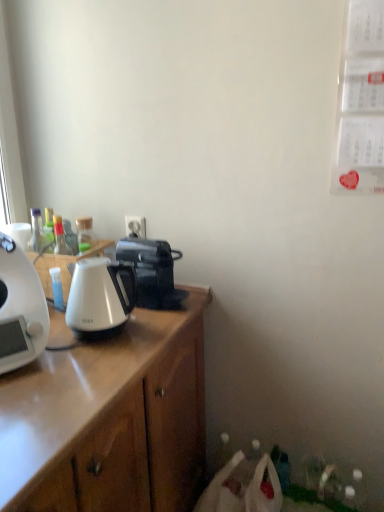
Question: Does white glossy coffee maker at left, which is counted as the 2th coffee maker, starting from the back, have a larger size compared to white glossy kettle at left?

Choices:
 (A) yes
 (B) no

Answer: (A)

Question: Can you confirm if white glossy coffee maker at left, which is counted as the 2th coffee maker, starting from the back, is shorter than white glossy kettle at left?

Choices:
 (A) no
 (B) yes

Answer: (A)

Question: Can we say white glossy coffee maker at left, marked as the first coffee maker in a front-to-back arrangement, lies outside white glossy kettle at left?

Choices:
 (A) no
 (B) yes

Answer: (B)

Question: Is white glossy coffee maker at left, which is counted as the 2th coffee maker, starting from the back, thinner than white glossy kettle at left?

Choices:
 (A) no
 (B) yes

Answer: (A)

Question: Would you say white glossy coffee maker at left, placed as the second coffee maker when sorted from right to left, contains white glossy kettle at left?

Choices:
 (A) yes
 (B) no

Answer: (B)

Question: From a real-world perspective, is white glossy coffee maker at left, marked as the first coffee maker in a front-to-back arrangement, located higher than white glossy kettle at left?

Choices:
 (A) no
 (B) yes

Answer: (B)

Question: Is the surface of white glossy kettle at left in direct contact with white plastic power outlet at center?

Choices:
 (A) no
 (B) yes

Answer: (A)

Question: Would you say white plastic power outlet at center is part of white glossy kettle at left's contents?

Choices:
 (A) no
 (B) yes

Answer: (A)

Question: Is white glossy kettle at left not inside white plastic power outlet at center?

Choices:
 (A) yes
 (B) no

Answer: (A)

Question: From the image's perspective, does white glossy kettle at left appear lower than white plastic power outlet at center?

Choices:
 (A) yes
 (B) no

Answer: (A)

Question: Is white glossy kettle at left oriented away from white plastic power outlet at center?

Choices:
 (A) yes
 (B) no

Answer: (B)

Question: From the image's perspective, would you say white glossy kettle at left is positioned over white plastic power outlet at center?

Choices:
 (A) yes
 (B) no

Answer: (B)

Question: Are white glossy kettle at left and white glossy kettle at left far apart?

Choices:
 (A) yes
 (B) no

Answer: (B)